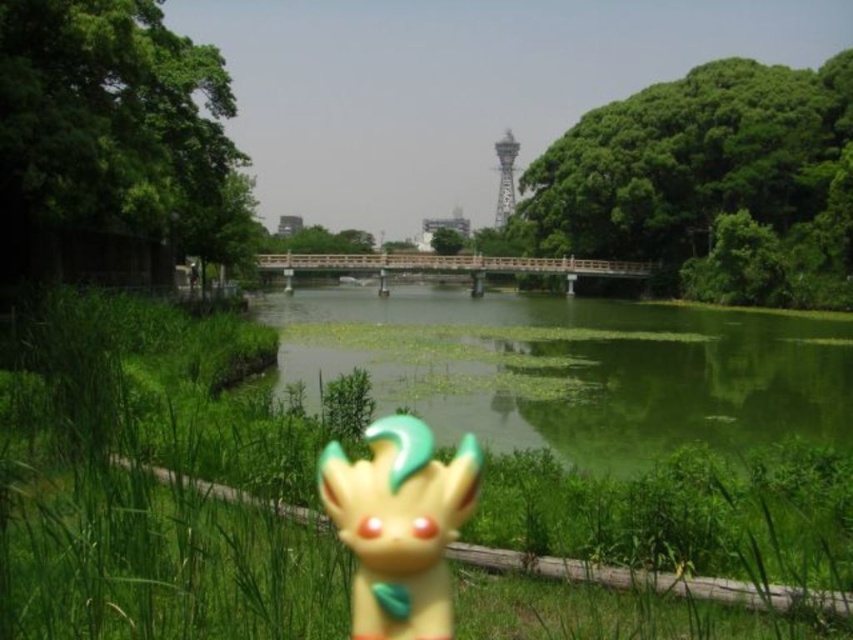
What is located at the coordinates point (438, 454) in the park scene?

The point (438, 454) indicates green matte grass at center.

You are a drone operator trying to capture a photo of the green matte grass at center. The camera is positioned at the origin point. What are the coordinates where you should direct the camera to focus?

The coordinates to focus on are at point (438, 454).

In the scene shown: You are standing in the park and want to take a photo of the metallic silver tower at center without the green matte grass at center blocking the view. Is this possible?

The green matte grass at center is in front of the metallic silver tower at center, so you cannot take a photo of the metallic silver tower at center without the green matte grass at center blocking the view.